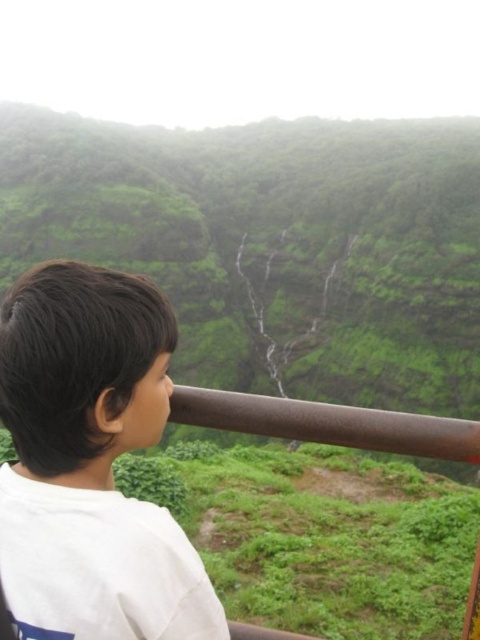
You are standing on a viewing platform and see the green matte mountain at upper center and the white matte shirt at left. Which object is taller?

The green matte mountain at upper center is taller than the white matte shirt at left.

You are a park ranger who needs to set up a safety barrier between the green matte mountain at upper center and the white matte shirt at left. The safety regulations require a minimum distance of 100 meters between visitors and the mountain. Based on the scene, is the current distance compliant with the regulations?

The distance between the green matte mountain at upper center and the white matte shirt at left is 118.69 meters, which exceeds the required 100 meters. Therefore, the current distance is compliant with the safety regulations.